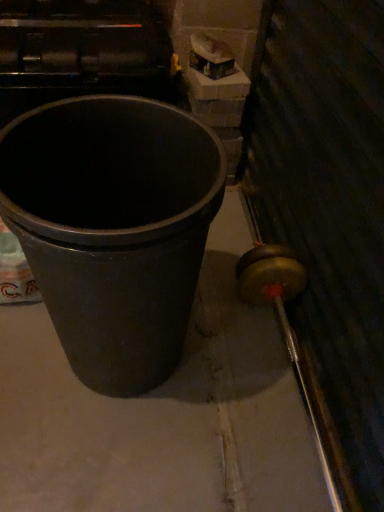
Identify the location of spots to the right of black plastic trash can at left. This screenshot has width=384, height=512. (246, 375).